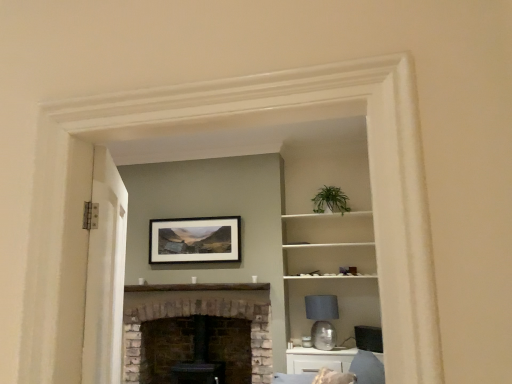
The height and width of the screenshot is (384, 512). What do you see at coordinates (195, 240) in the screenshot?
I see `matte black picture frame at center` at bounding box center [195, 240].

What is the approximate height of matte black picture frame at center?

20.03 inches.

What is the approximate height of white painted wood door at left?

white painted wood door at left is 35.03 inches in height.

You are a GUI agent. You are given a task and a screenshot of the screen. Output one action in this format:
    pyautogui.click(x=<x>, y=<y>)
    Task: Click on the matte gray glass lampshade at center-right
    The image size is (512, 384).
    Given the screenshot: What is the action you would take?
    pyautogui.click(x=322, y=320)

You are a GUI agent. You are given a task and a screenshot of the screen. Output one action in this format:
    pyautogui.click(x=<x>, y=<y>)
    Task: Click on the matte black picture frame at center
    The width and height of the screenshot is (512, 384).
    Given the screenshot: What is the action you would take?
    pyautogui.click(x=195, y=240)

Between matte gray glass lampshade at center-right and white glossy cabinet at lower right, which one has smaller width?

Thinner between the two is matte gray glass lampshade at center-right.

Is white glossy cabinet at lower right completely or partially inside matte gray glass lampshade at center-right?

No, white glossy cabinet at lower right is not surrounded by matte gray glass lampshade at center-right.

Considering the sizes of matte gray glass lampshade at center-right and white glossy cabinet at lower right in the image, is matte gray glass lampshade at center-right bigger or smaller than white glossy cabinet at lower right?

matte gray glass lampshade at center-right is smaller than white glossy cabinet at lower right.

From a real-world perspective, between white painted wood door at left and white stone fireplace at center, who is vertically lower?

In real-world perspective, white stone fireplace at center is lower.

Which is closer to the camera, (x=106, y=174) or (x=222, y=308)?

Point (x=106, y=174) is closer to the camera than point (x=222, y=308).

Could you tell me if white painted wood door at left is turned towards white stone fireplace at center?

No, white painted wood door at left is not turned towards white stone fireplace at center.

Considering the positions of objects white painted wood door at left and white stone fireplace at center in the image provided, who is more to the right, white painted wood door at left or white stone fireplace at center?

white painted wood door at left.

Is matte gray glass lampshade at center-right looking in the opposite direction of white painted wood door at left?

No, matte gray glass lampshade at center-right is not facing the opposite direction of white painted wood door at left.

From a real-world perspective, who is located higher, matte gray glass lampshade at center-right or white painted wood door at left?

white painted wood door at left, from a real-world perspective.

Is white painted wood door at left inside matte gray glass lampshade at center-right?

No, white painted wood door at left is not surrounded by matte gray glass lampshade at center-right.

Is point (330, 346) farther from viewer compared to point (97, 204)?

Yes.

Is white painted wood door at left looking in the opposite direction of matte black picture frame at center?

No, white painted wood door at left is not facing away from matte black picture frame at center.

Can you tell me how much white painted wood door at left and matte black picture frame at center differ in facing direction?

The facing directions of white painted wood door at left and matte black picture frame at center are 113 degrees apart.

Consider the image. Does white painted wood door at left touch matte black picture frame at center?

white painted wood door at left and matte black picture frame at center are clearly separated.

Considering the positions of objects white painted wood door at left and matte black picture frame at center in the image provided, who is behind, white painted wood door at left or matte black picture frame at center?

matte black picture frame at center is more distant.

Is white stone fireplace at center at the right side of white glossy cabinet at lower right?

No, white stone fireplace at center is not to the right of white glossy cabinet at lower right.

The width and height of the screenshot is (512, 384). I want to click on fireplace on the left of white glossy cabinet at lower right, so click(x=199, y=314).

Does white stone fireplace at center contain white glossy cabinet at lower right?

No, white glossy cabinet at lower right is not surrounded by white stone fireplace at center.

From the picture: Is white stone fireplace at center wider than white glossy cabinet at lower right?

Yes.

Between matte black picture frame at center and white stone fireplace at center, which one has less height?

matte black picture frame at center.

Which object is further away from the camera taking this photo, matte black picture frame at center or white stone fireplace at center?

matte black picture frame at center is more distant.

Is matte black picture frame at center thinner than white stone fireplace at center?

Indeed, matte black picture frame at center has a lesser width compared to white stone fireplace at center.

Considering the relative positions of matte black picture frame at center and white stone fireplace at center in the image provided, is matte black picture frame at center to the right of white stone fireplace at center from the viewer's perspective?

Incorrect, matte black picture frame at center is not on the right side of white stone fireplace at center.

From a real-world perspective, is white glossy cabinet at lower right beneath white stone fireplace at center?

Yes, from a real-world perspective, white glossy cabinet at lower right is below white stone fireplace at center.

Which of these two, white glossy cabinet at lower right or white stone fireplace at center, stands taller?

With more height is white stone fireplace at center.

Does white glossy cabinet at lower right have a lesser width compared to white stone fireplace at center?

Yes, white glossy cabinet at lower right is thinner than white stone fireplace at center.

Where is `cabinetry above the white stone fireplace at center (from the image's perspective)`? The width and height of the screenshot is (512, 384). cabinetry above the white stone fireplace at center (from the image's perspective) is located at coordinates (318, 360).

Where is `cabinetry located on the left of matte gray glass lampshade at center-right`? This screenshot has height=384, width=512. cabinetry located on the left of matte gray glass lampshade at center-right is located at coordinates (318, 360).

The image size is (512, 384). I want to click on door in front of the white stone fireplace at center, so click(x=105, y=273).

When comparing their distances from matte gray glass lampshade at center-right, does white painted wood door at left or matte black picture frame at center seem closer?

matte black picture frame at center.

Estimate the real-world distances between objects in this image. Which object is closer to matte gray glass lampshade at center-right, matte black picture frame at center or white glossy cabinet at lower right?

Based on the image, white glossy cabinet at lower right appears to be nearer to matte gray glass lampshade at center-right.

Considering their positions, is white stone fireplace at center positioned closer to matte gray glass lampshade at center-right than matte black picture frame at center?

white stone fireplace at center is closer to matte gray glass lampshade at center-right.

Which object lies further to the anchor point white glossy cabinet at lower right, white stone fireplace at center or matte gray glass lampshade at center-right?

white stone fireplace at center.

Considering their positions, is white painted wood door at left positioned closer to white glossy cabinet at lower right than matte gray glass lampshade at center-right?

Among the two, matte gray glass lampshade at center-right is located nearer to white glossy cabinet at lower right.

From the image, which object appears to be farther from white painted wood door at left, matte gray glass lampshade at center-right or white glossy cabinet at lower right?

Based on the image, matte gray glass lampshade at center-right appears to be further to white painted wood door at left.

When comparing their distances from white painted wood door at left, does white glossy cabinet at lower right or matte black picture frame at center seem further?

white glossy cabinet at lower right lies further to white painted wood door at left than the other object.

Based on their spatial positions, is white painted wood door at left or matte black picture frame at center further from white stone fireplace at center?

white painted wood door at left is further to white stone fireplace at center.

Locate an element on the screen. fireplace between white painted wood door at left and matte gray glass lampshade at center-right along the z-axis is located at coordinates (199, 314).

Locate an element on the screen. The image size is (512, 384). cabinetry between white painted wood door at left and white stone fireplace at center along the z-axis is located at coordinates (318, 360).

Where is `fireplace between matte black picture frame at center and matte gray glass lampshade at center-right from left to right`? The image size is (512, 384). fireplace between matte black picture frame at center and matte gray glass lampshade at center-right from left to right is located at coordinates (199, 314).

Where is `lamp located between white painted wood door at left and matte black picture frame at center in the depth direction`? The width and height of the screenshot is (512, 384). lamp located between white painted wood door at left and matte black picture frame at center in the depth direction is located at coordinates (322, 320).